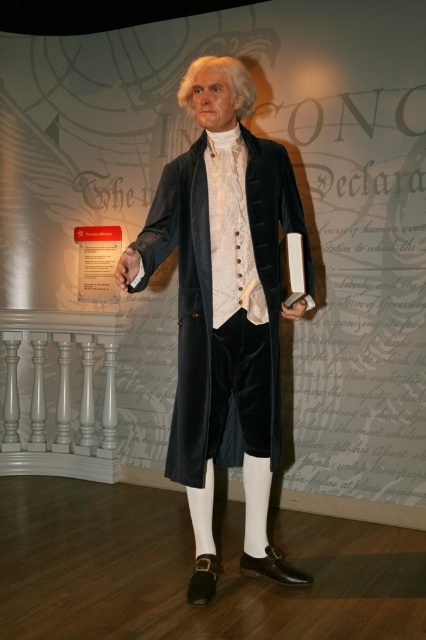
You are a photographer standing in front of the wax figure of Thomas Jefferson. You notice two points marked on the image at coordinates point (259,419) and point (305,301). Which point is closer to your camera lens?

Point (259,419) is further to the camera than point (305,301), so the point closer to the camera lens is point (305,301).